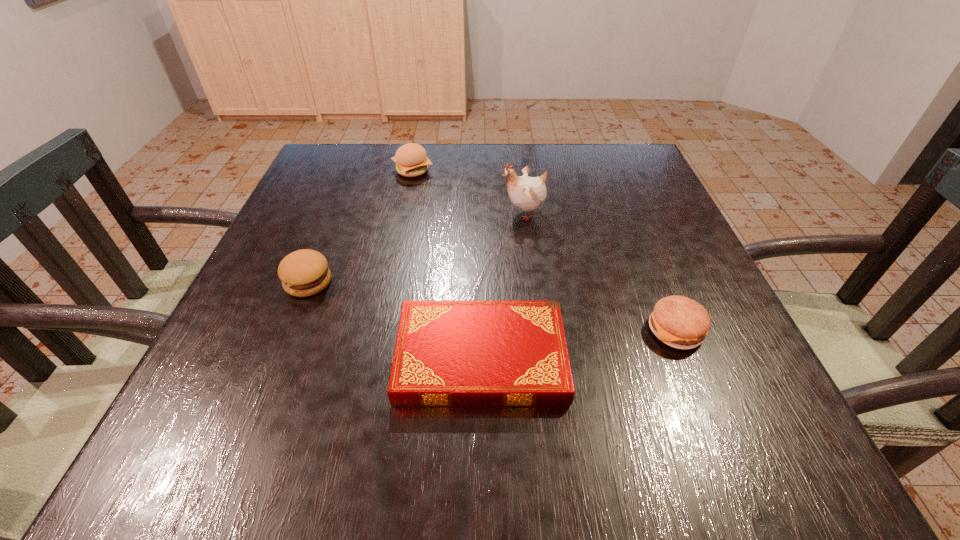
At what (x,y) coordinates should I click in order to perform the action: click on hamburger identified as the closest to the leftmost object. Please return your answer as a coordinate pair (x, y). The height and width of the screenshot is (540, 960). Looking at the image, I should click on (411, 160).

Identify which hamburger is the second closest to the nearest hamburger. Please provide its 2D coordinates. Your answer should be formatted as a tuple, i.e. [(x, y)], where the tuple contains the x and y coordinates of a point satisfying the conditions above.

[(411, 160)]

This screenshot has width=960, height=540. I want to click on free location that satisfies the following two spatial constraints: 1. at the beak of the fourth nearest object; 2. on the front side of the leftmost hamburger, so click(533, 282).

Locate an element on the screen. free space that satisfies the following two spatial constraints: 1. at the beak of the rightmost object; 2. on the left side of the bird is located at coordinates (539, 330).

This screenshot has width=960, height=540. What are the coordinates of `vacant area that satisfies the following two spatial constraints: 1. at the beak of the bird; 2. on the left side of the rightmost hamburger` in the screenshot? It's located at (539, 330).

Locate an element on the screen. This screenshot has width=960, height=540. vacant space that satisfies the following two spatial constraints: 1. on the front side of the rightmost object; 2. on the cover of the shortest object is located at coordinates (686, 357).